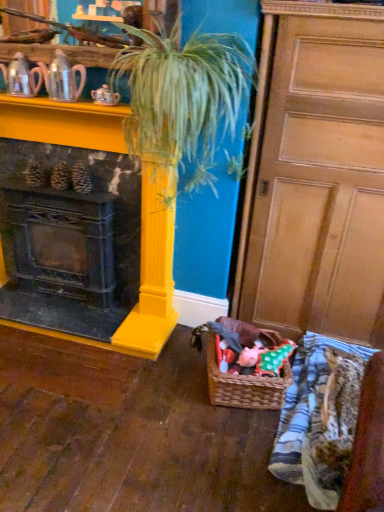
Question: Should I look upward or downward to see metallic silver teapot at left, placed as the second tea pot when sorted from right to left?

Choices:
 (A) up
 (B) down

Answer: (A)

Question: Is black cast iron fireplace at left touching striped cotton blanket at lower right?

Choices:
 (A) no
 (B) yes

Answer: (A)

Question: Is striped cotton blanket at lower right a part of black cast iron fireplace at left?

Choices:
 (A) no
 (B) yes

Answer: (A)

Question: From a real-world perspective, is black cast iron fireplace at left positioned over striped cotton blanket at lower right based on gravity?

Choices:
 (A) yes
 (B) no

Answer: (A)

Question: Does black cast iron fireplace at left have a greater height compared to striped cotton blanket at lower right?

Choices:
 (A) yes
 (B) no

Answer: (A)

Question: Is black cast iron fireplace at left oriented away from striped cotton blanket at lower right?

Choices:
 (A) yes
 (B) no

Answer: (B)

Question: Is black cast iron fireplace at left located outside striped cotton blanket at lower right?

Choices:
 (A) no
 (B) yes

Answer: (B)

Question: Can you confirm if striped cotton blanket at lower right is shorter than metallic silver teapot at left, placed as the second tea pot when sorted from right to left?

Choices:
 (A) yes
 (B) no

Answer: (A)

Question: From a real-world perspective, is striped cotton blanket at lower right over metallic silver teapot at left, placed as the second tea pot when sorted from right to left?

Choices:
 (A) no
 (B) yes

Answer: (A)

Question: Is striped cotton blanket at lower right positioned in front of metallic silver teapot at left, placed as the second tea pot when sorted from right to left?

Choices:
 (A) no
 (B) yes

Answer: (B)

Question: Would you say striped cotton blanket at lower right is outside metallic silver teapot at left, the 1th tea pot viewed from the left?

Choices:
 (A) no
 (B) yes

Answer: (B)

Question: Can you confirm if striped cotton blanket at lower right is taller than metallic silver teapot at left, placed as the second tea pot when sorted from right to left?

Choices:
 (A) no
 (B) yes

Answer: (A)

Question: Is striped cotton blanket at lower right placed right next to metallic silver teapot at left, the 1th tea pot viewed from the left?

Choices:
 (A) yes
 (B) no

Answer: (B)

Question: Considering the relative sizes of striped cotton blanket at lower right and woven brown basket at lower center in the image provided, is striped cotton blanket at lower right bigger than woven brown basket at lower center?

Choices:
 (A) no
 (B) yes

Answer: (B)